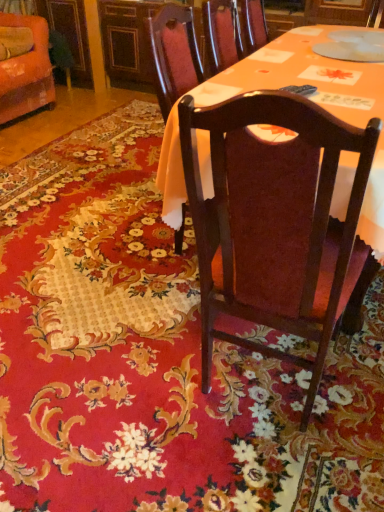
The image size is (384, 512). I want to click on vacant space positioned to the left of dark wood chair at center, acting as the second chair starting from the left, so coord(131,371).